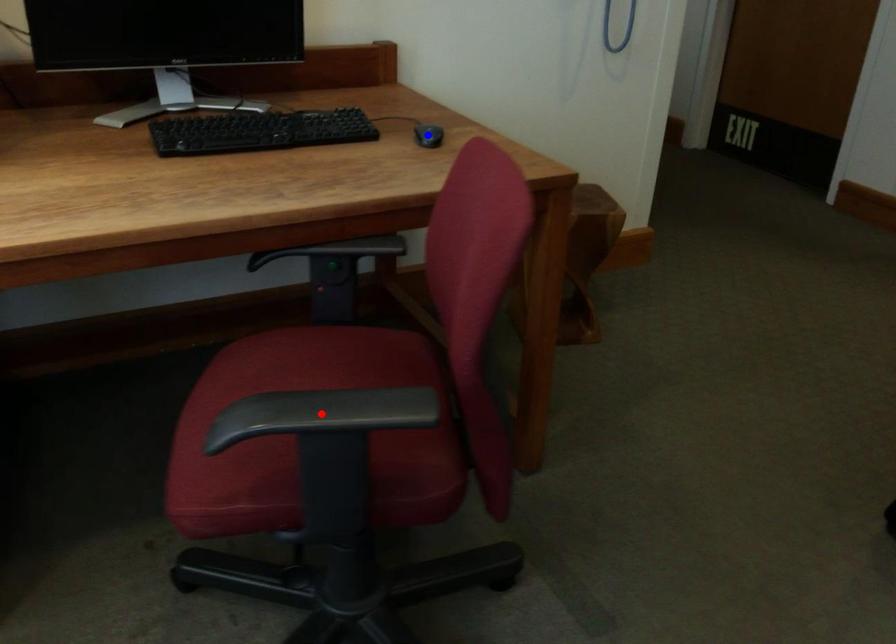
Question: Two points are marked on the image. Which point is closer to the camera?

Choices:
 (A) Blue point is closer.
 (B) Red point is closer.

Answer: (B)